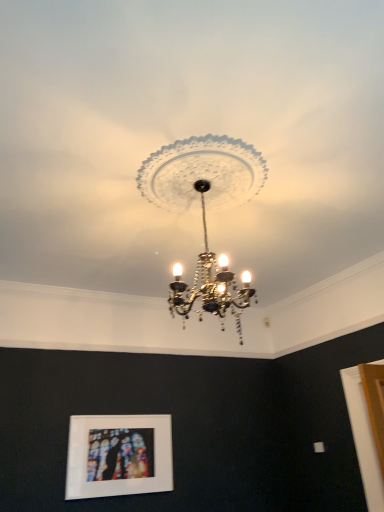
Question: Is clear glass chandelier at center thinner than matte white picture frame at lower center?

Choices:
 (A) no
 (B) yes

Answer: (A)

Question: Is clear glass chandelier at center touching matte white picture frame at lower center?

Choices:
 (A) yes
 (B) no

Answer: (B)

Question: Is clear glass chandelier at center positioned in front of matte white picture frame at lower center?

Choices:
 (A) yes
 (B) no

Answer: (A)

Question: Is clear glass chandelier at center shorter than matte white picture frame at lower center?

Choices:
 (A) yes
 (B) no

Answer: (B)

Question: From the image's perspective, is clear glass chandelier at center over matte white picture frame at lower center?

Choices:
 (A) no
 (B) yes

Answer: (B)

Question: Can you confirm if clear glass chandelier at center is positioned to the left of matte white picture frame at lower center?

Choices:
 (A) no
 (B) yes

Answer: (A)

Question: From the image's perspective, does matte white picture frame at lower center appear lower than clear glass chandelier at center?

Choices:
 (A) yes
 (B) no

Answer: (A)

Question: Does matte white picture frame at lower center touch clear glass chandelier at center?

Choices:
 (A) no
 (B) yes

Answer: (A)

Question: Is matte white picture frame at lower center positioned with its back to clear glass chandelier at center?

Choices:
 (A) no
 (B) yes

Answer: (A)

Question: Could you tell me if matte white picture frame at lower center is facing clear glass chandelier at center?

Choices:
 (A) no
 (B) yes

Answer: (B)

Question: Can you confirm if matte white picture frame at lower center is bigger than clear glass chandelier at center?

Choices:
 (A) no
 (B) yes

Answer: (A)

Question: Is matte white picture frame at lower center shorter than clear glass chandelier at center?

Choices:
 (A) no
 (B) yes

Answer: (B)

Question: Considering the positions of matte white picture frame at lower center and clear glass chandelier at center in the image, is matte white picture frame at lower center wider or thinner than clear glass chandelier at center?

Choices:
 (A) wide
 (B) thin

Answer: (B)